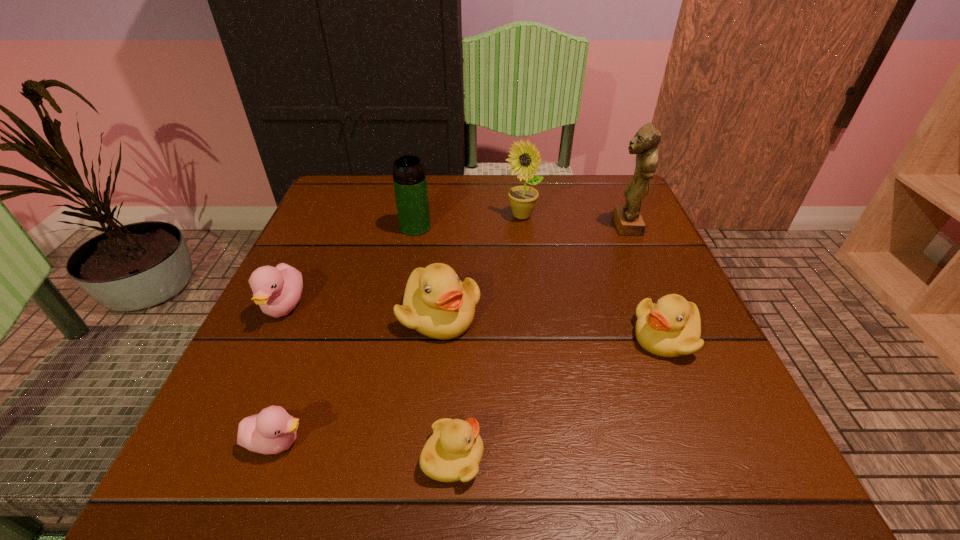
This screenshot has height=540, width=960. I want to click on vacant space that is in between the bigger pink duckling and the nearer pink duckling, so click(x=281, y=374).

Identify the location of free space between the farther pink duckling and the tallest object. (455, 266).

The width and height of the screenshot is (960, 540). Identify the location of free space between the thermos bottle and the smaller pink duckling. (347, 334).

The width and height of the screenshot is (960, 540). In order to click on vacant point located between the bigger pink duckling and the smaller pink duckling in this screenshot , I will do `click(281, 374)`.

Find the location of `object that is the closest to the biggest yellow duckling`. object that is the closest to the biggest yellow duckling is located at coordinates (453, 452).

Identify the location of the seventh closest object to the thermos bottle. This screenshot has width=960, height=540. (453, 452).

Where is `duckling object that ranks as the closest to the second biggest yellow duckling`? This screenshot has height=540, width=960. duckling object that ranks as the closest to the second biggest yellow duckling is located at coordinates 436,303.

Select which duckling is the fourth closest to the rightmost yellow duckling. Please provide its 2D coordinates. Your answer should be formatted as a tuple, i.e. [(x, y)], where the tuple contains the x and y coordinates of a point satisfying the conditions above.

[(277, 290)]

Identify which yellow duckling is the nearest to the farther pink duckling. Please provide its 2D coordinates. Your answer should be formatted as a tuple, i.e. [(x, y)], where the tuple contains the x and y coordinates of a point satisfying the conditions above.

[(436, 303)]

Where is `yellow duckling that stands as the closest to the tallest object`? Image resolution: width=960 pixels, height=540 pixels. yellow duckling that stands as the closest to the tallest object is located at coordinates (671, 327).